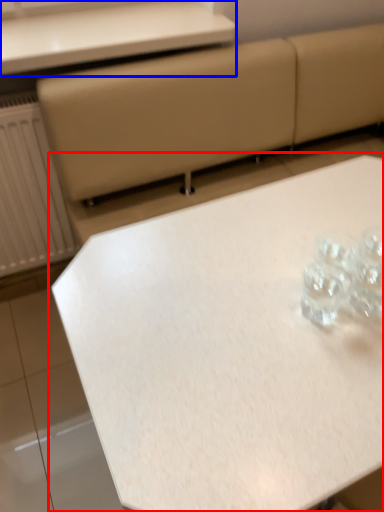
Question: Which object is further to the camera taking this photo, table (highlighted by a red box) or table (highlighted by a blue box)?

Choices:
 (A) table
 (B) table

Answer: (B)